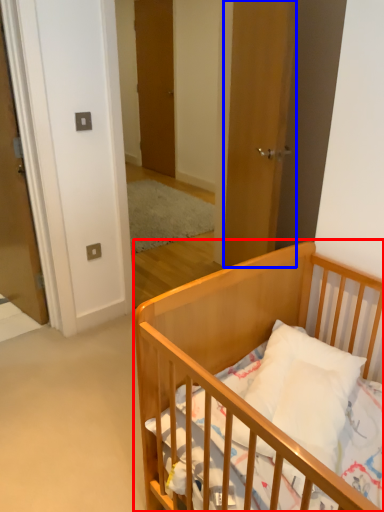
Question: Which of the following is the closest to the observer, infant bed (highlighted by a red box) or door (highlighted by a blue box)?

Choices:
 (A) infant bed
 (B) door

Answer: (A)